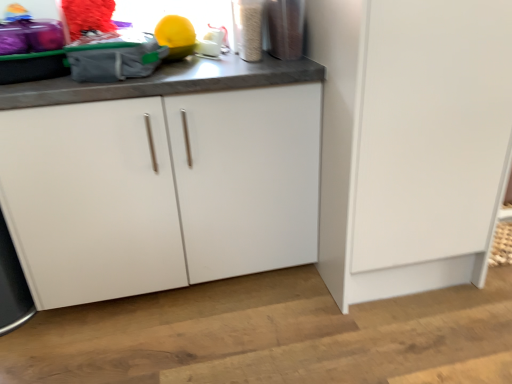
Question: From the image's perspective, is metallic silver canister at upper right, positioned as the second appliance in right-to-left order, located above or below white matte cabinet door at lower right?

Choices:
 (A) below
 (B) above

Answer: (B)

Question: Is metallic silver canister at upper right, the 1th appliance in the left-to-right sequence, inside or outside of white matte cabinet door at lower right?

Choices:
 (A) inside
 (B) outside

Answer: (B)

Question: Which object is the farthest from the white matte cabinet at center?

Choices:
 (A) metallic silver container at upper right, placed as the first appliance when sorted from right to left
 (B) metallic silver canister at upper right, the 1th appliance in the left-to-right sequence
 (C) white matte cabinet door at lower right

Answer: (A)

Question: Which object is positioned farthest from the white matte cabinet door at lower right?

Choices:
 (A) white matte cabinet at center
 (B) metallic silver canister at upper right, the 1th appliance in the left-to-right sequence
 (C) metallic silver container at upper right, placed as the first appliance when sorted from right to left

Answer: (B)